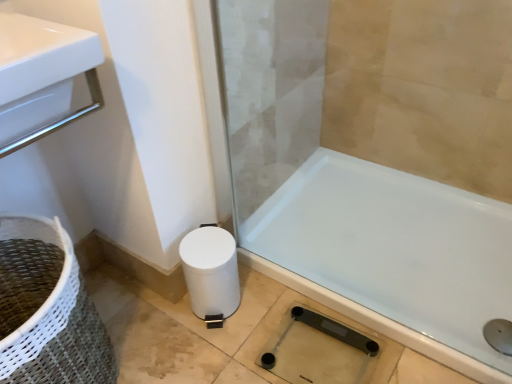
Question: Is white woven basket at lower left positioned before transparent glass shower at lower right?

Choices:
 (A) no
 (B) yes

Answer: (B)

Question: Could you tell me if white woven basket at lower left is turned towards transparent glass shower at lower right?

Choices:
 (A) yes
 (B) no

Answer: (B)

Question: Is white woven basket at lower left at the left side of transparent glass shower at lower right?

Choices:
 (A) no
 (B) yes

Answer: (B)

Question: Considering the relative sizes of white woven basket at lower left and transparent glass shower at lower right in the image provided, is white woven basket at lower left taller than transparent glass shower at lower right?

Choices:
 (A) yes
 (B) no

Answer: (A)

Question: From the image's perspective, is white woven basket at lower left under transparent glass shower at lower right?

Choices:
 (A) yes
 (B) no

Answer: (B)

Question: Does white woven basket at lower left have a smaller size compared to transparent glass shower at lower right?

Choices:
 (A) no
 (B) yes

Answer: (A)

Question: Is white glossy bathtub at lower right located within white matte toilet paper at lower left?

Choices:
 (A) no
 (B) yes

Answer: (A)

Question: Are white matte toilet paper at lower left and white glossy bathtub at lower right located far from each other?

Choices:
 (A) no
 (B) yes

Answer: (A)

Question: Can you confirm if white matte toilet paper at lower left is positioned to the left of white glossy bathtub at lower right?

Choices:
 (A) no
 (B) yes

Answer: (B)

Question: Does white matte toilet paper at lower left turn towards white glossy bathtub at lower right?

Choices:
 (A) yes
 (B) no

Answer: (B)

Question: Is white matte toilet paper at lower left taller than white glossy bathtub at lower right?

Choices:
 (A) no
 (B) yes

Answer: (B)

Question: From a real-world perspective, is white matte toilet paper at lower left located beneath white glossy bathtub at lower right?

Choices:
 (A) yes
 (B) no

Answer: (B)

Question: From a real-world perspective, is white glossy bathtub at lower right below transparent glass shower at lower right?

Choices:
 (A) yes
 (B) no

Answer: (A)